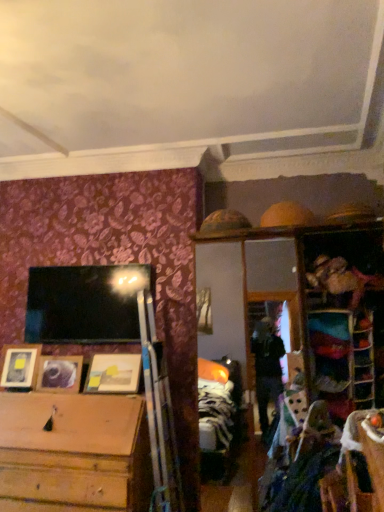
Question: Is wooden picture frame at lower left, which appears as the 1th picture frame when viewed from the left, wider than wooden picture frame at left, the second picture frame viewed from the left?

Choices:
 (A) yes
 (B) no

Answer: (A)

Question: Can you confirm if wooden picture frame at lower left, which appears as the 1th picture frame when viewed from the left, is thinner than wooden picture frame at left, the second picture frame viewed from the left?

Choices:
 (A) no
 (B) yes

Answer: (A)

Question: From the image's perspective, is wooden picture frame at lower left, which is counted as the third picture frame, starting from the right, under wooden picture frame at left, which is the 2th picture frame in right-to-left order?

Choices:
 (A) yes
 (B) no

Answer: (B)

Question: Does wooden picture frame at lower left, which appears as the 1th picture frame when viewed from the left, appear on the right side of wooden picture frame at left, which is the 2th picture frame in right-to-left order?

Choices:
 (A) no
 (B) yes

Answer: (A)

Question: Is wooden picture frame at lower left, which is counted as the third picture frame, starting from the right, outside of wooden picture frame at left, the second picture frame viewed from the left?

Choices:
 (A) no
 (B) yes

Answer: (B)

Question: Does wooden picture frame at lower left, which is counted as the third picture frame, starting from the right, have a lesser height compared to wooden picture frame at left, which is the 2th picture frame in right-to-left order?

Choices:
 (A) no
 (B) yes

Answer: (A)

Question: From a real-world perspective, is metallic reflective frame at upper right, which is the first shelf from left to right, physically above wooden picture frame at left, the second picture frame viewed from the left?

Choices:
 (A) yes
 (B) no

Answer: (A)

Question: From the image's perspective, is metallic reflective frame at upper right, the second shelf when ordered from right to left, above wooden picture frame at left, which is the 2th picture frame in right-to-left order?

Choices:
 (A) yes
 (B) no

Answer: (A)

Question: From the image's perspective, is metallic reflective frame at upper right, which is the first shelf from left to right, under wooden picture frame at left, the second picture frame viewed from the left?

Choices:
 (A) no
 (B) yes

Answer: (A)

Question: Does metallic reflective frame at upper right, which is the first shelf from left to right, have a greater width compared to wooden picture frame at left, which is the 2th picture frame in right-to-left order?

Choices:
 (A) yes
 (B) no

Answer: (B)

Question: Is wooden picture frame at left, the second picture frame viewed from the left, a part of metallic reflective frame at upper right, which is the first shelf from left to right?

Choices:
 (A) yes
 (B) no

Answer: (B)

Question: Is metallic reflective frame at upper right, the second shelf when ordered from right to left, to the left of wooden picture frame at left, the second picture frame viewed from the left, from the viewer's perspective?

Choices:
 (A) yes
 (B) no

Answer: (B)

Question: Does metallic reflective frame at upper right, the second shelf when ordered from right to left, have a lesser width compared to wooden picture frame at center, which ranks as the third picture frame in left-to-right order?

Choices:
 (A) no
 (B) yes

Answer: (B)